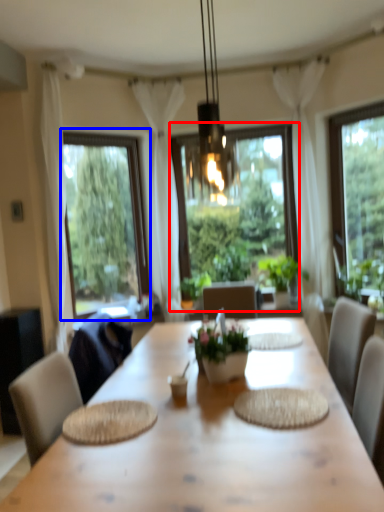
Question: Which object is closer to the camera taking this photo, window (highlighted by a red box) or window (highlighted by a blue box)?

Choices:
 (A) window
 (B) window

Answer: (B)